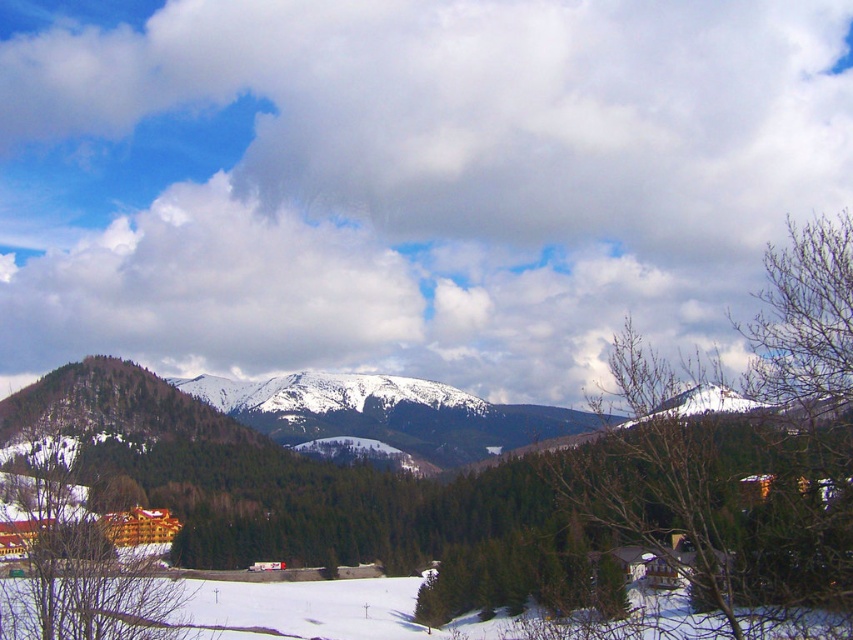
You are planning a drone flight route from the green matte tree at lower left to the white fluffy cloud at upper center. Given that your drone has a maximum range of 300 meters, will it be able to reach the cloud without needing a recharge?

The white fluffy cloud at upper center is 350.77 meters away from the green matte tree at lower left. Since the drone can only fly up to 300 meters before needing a recharge, it will not be able to reach the cloud without recharging.

You are standing in the winter landscape and want to walk from the point at coordinates point (654, 173) to the point at coordinates point (35, 496). Which direction should you move to get closer to your destination?

To move from point (654, 173) to point (35, 496), you should move towards the lower right direction since point (35, 496) is closer to the viewer than point (654, 173).

You are an airplane pilot preparing to land your plane on a runway that is just wide enough for your aircraft. You notice the white fluffy cloud at upper center and the green matte tree at lower left in the distance. Based on their sizes, which object would appear larger to you from your current altitude?

The white fluffy cloud at upper center appears larger than the green matte tree at lower left because its width surpasses the tree.